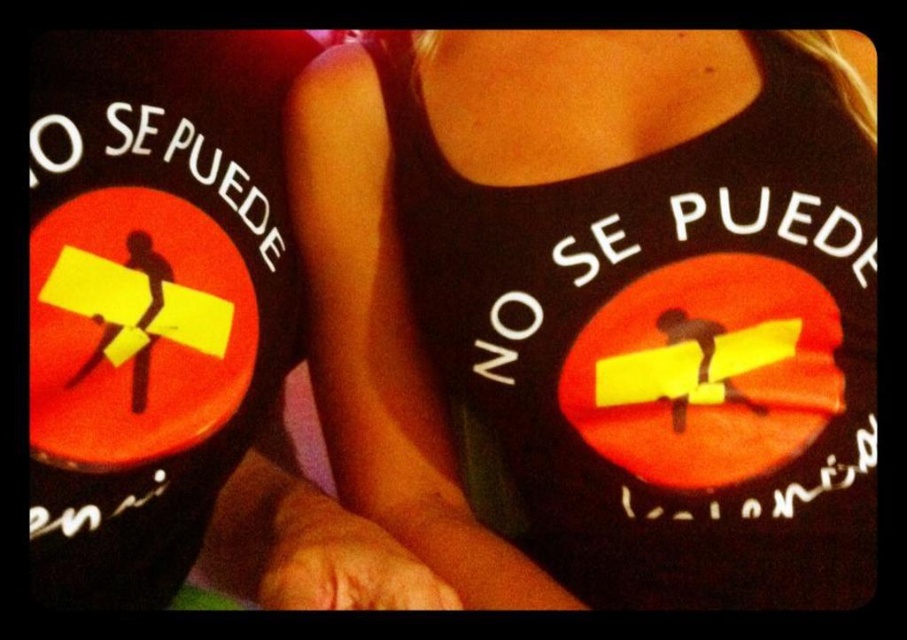
Does black fabric tank top at center have a lesser width compared to black matte tank top at upper center?

In fact, black fabric tank top at center might be wider than black matte tank top at upper center.

Who is higher up, black fabric tank top at center or black matte tank top at upper center?

black fabric tank top at center is above.

Which is behind, point (389, 221) or point (30, 188)?

Positioned behind is point (389, 221).

At what (x,y) coordinates should I click in order to perform the action: click on black fabric tank top at center. Please return your answer as a coordinate pair (x, y). The height and width of the screenshot is (640, 907). Looking at the image, I should click on (601, 305).